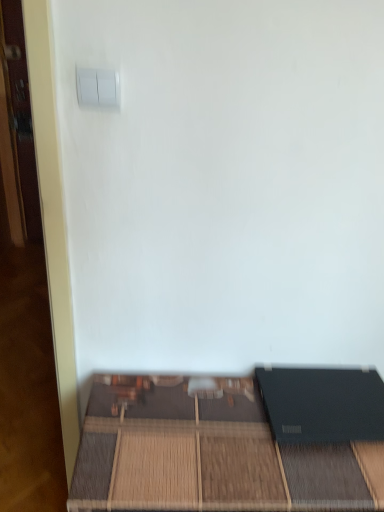
What is the approximate width of white plastic light switch at upper left?

white plastic light switch at upper left is 0.92 inches wide.

Identify the location of white plastic light switch at upper left. (97, 87).

The height and width of the screenshot is (512, 384). What do you see at coordinates (97, 87) in the screenshot?
I see `white plastic light switch at upper left` at bounding box center [97, 87].

Measure the distance between point (187, 458) and camera.

The depth of point (187, 458) is 91.90 centimeters.

Locate an element on the screen. The height and width of the screenshot is (512, 384). matte black laptop at lower right is located at coordinates (209, 455).

What do you see at coordinates (209, 455) in the screenshot? The image size is (384, 512). I see `matte black laptop at lower right` at bounding box center [209, 455].

What are the coordinates of `white plastic light switch at upper left` in the screenshot? It's located at pos(97,87).

Considering the relative positions of matte black laptop at lower right and white plastic light switch at upper left in the image provided, is matte black laptop at lower right to the left of white plastic light switch at upper left from the viewer's perspective?

In fact, matte black laptop at lower right is to the right of white plastic light switch at upper left.

Relative to white plastic light switch at upper left, is matte black laptop at lower right in front or behind?

Visually, matte black laptop at lower right is located behind white plastic light switch at upper left.

Considering the positions of points (96, 506) and (106, 70), is point (96, 506) closer to camera compared to point (106, 70)?

No.

From the image's perspective, between matte black laptop at lower right and white plastic light switch at upper left, which one is located above?

white plastic light switch at upper left is shown above in the image.

From a real-world perspective, is matte black laptop at lower right on top of white plastic light switch at upper left?

No, from a real-world perspective, matte black laptop at lower right is not over white plastic light switch at upper left

Considering the sizes of objects matte black laptop at lower right and white plastic light switch at upper left in the image provided, who is wider, matte black laptop at lower right or white plastic light switch at upper left?

matte black laptop at lower right.

Is matte black laptop at lower right taller than white plastic light switch at upper left?

Correct, matte black laptop at lower right is much taller as white plastic light switch at upper left.

Considering the relative sizes of matte black laptop at lower right and white plastic light switch at upper left in the image provided, is matte black laptop at lower right smaller than white plastic light switch at upper left?

Incorrect, matte black laptop at lower right is not smaller in size than white plastic light switch at upper left.

Is white plastic light switch at upper left inside matte black laptop at lower right?

No, matte black laptop at lower right does not contain white plastic light switch at upper left.

Is matte black laptop at lower right far away from white plastic light switch at upper left?

No, matte black laptop at lower right is not far away from white plastic light switch at upper left.

Is matte black laptop at lower right facing towards white plastic light switch at upper left?

No, matte black laptop at lower right is not oriented towards white plastic light switch at upper left.

How different are the orientations of matte black laptop at lower right and white plastic light switch at upper left in degrees?

matte black laptop at lower right and white plastic light switch at upper left are facing 1.36 degrees away from each other.

Measure the distance from matte black laptop at lower right to white plastic light switch at upper left.

77.85 centimeters.

Locate an element on the screen. The width and height of the screenshot is (384, 512). light switch lying in front of the matte black laptop at lower right is located at coordinates (97, 87).

Is white plastic light switch at upper left to the left of matte black laptop at lower right from the viewer's perspective?

Yes.

Who is more distant, white plastic light switch at upper left or matte black laptop at lower right?

matte black laptop at lower right is further from the camera.

Considering the positions of points (77, 82) and (377, 483), is point (77, 82) farther from camera compared to point (377, 483)?

No, (77, 82) is closer to viewer.

From the image's perspective, is white plastic light switch at upper left located above or below matte black laptop at lower right?

Based on their image positions, white plastic light switch at upper left is located above matte black laptop at lower right.

From a real-world perspective, is white plastic light switch at upper left physically below matte black laptop at lower right?

Actually, white plastic light switch at upper left is physically above matte black laptop at lower right in the real world.

Is white plastic light switch at upper left wider or thinner than matte black laptop at lower right?

In the image, white plastic light switch at upper left appears to be more narrow than matte black laptop at lower right.

Does white plastic light switch at upper left have a greater height compared to matte black laptop at lower right?

In fact, white plastic light switch at upper left may be shorter than matte black laptop at lower right.

From the picture: Can you confirm if white plastic light switch at upper left is bigger than matte black laptop at lower right?

Answer: No.

Is matte black laptop at lower right located within white plastic light switch at upper left?

No.

Is white plastic light switch at upper left in contact with matte black laptop at lower right?

white plastic light switch at upper left and matte black laptop at lower right are not in contact.

Is white plastic light switch at upper left aimed at matte black laptop at lower right?

No, white plastic light switch at upper left is not oriented towards matte black laptop at lower right.

How different are the orientations of white plastic light switch at upper left and matte black laptop at lower right in degrees?

The angular difference between white plastic light switch at upper left and matte black laptop at lower right is 1.36 degrees.

Image resolution: width=384 pixels, height=512 pixels. What are the coordinates of `light switch above the matte black laptop at lower right (from a real-world perspective)` in the screenshot? It's located at (97, 87).

Where is `furniture on the right of the white plastic light switch at upper left`? The width and height of the screenshot is (384, 512). furniture on the right of the white plastic light switch at upper left is located at coordinates (209, 455).

Find the location of a particular element. This screenshot has height=512, width=384. light switch in front of the matte black laptop at lower right is located at coordinates (97, 87).